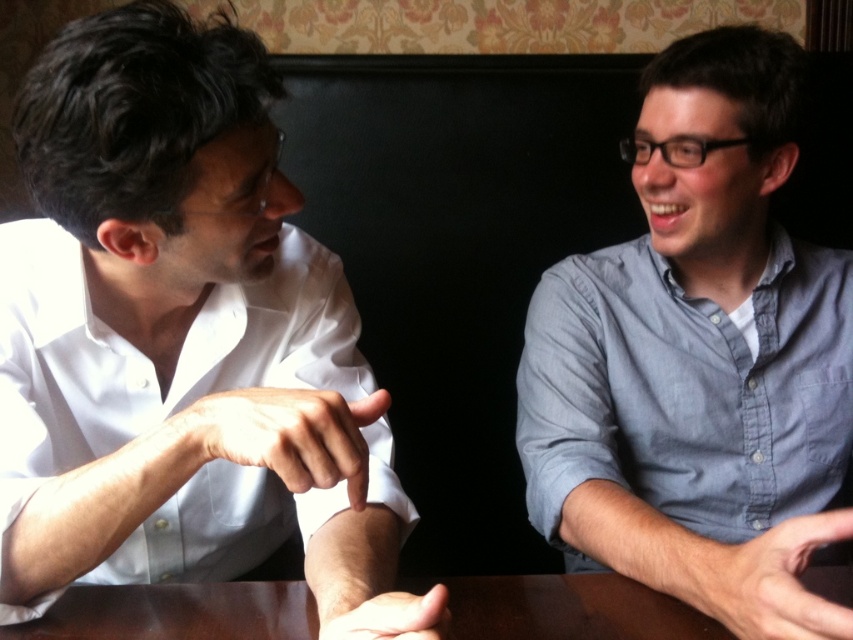
Question: Is blue denim shirt at right wider than white matte hand at center?

Choices:
 (A) yes
 (B) no

Answer: (A)

Question: Does white glossy shirt at left lie in front of brown wooden table at center?

Choices:
 (A) no
 (B) yes

Answer: (B)

Question: Is brown wooden table at center behind smooth skin hand at lower right?

Choices:
 (A) no
 (B) yes

Answer: (B)

Question: Based on their relative distances, which object is nearer to the white glossy shirt at left?

Choices:
 (A) white matte hand at center
 (B) blue denim shirt at right
 (C) smooth skin hand at lower center

Answer: (A)

Question: Considering the real-world distances, which object is closest to the smooth skin hand at lower center?

Choices:
 (A) white glossy shirt at left
 (B) smooth skin hand at lower right
 (C) blue denim shirt at right

Answer: (A)

Question: Estimate the real-world distances between objects in this image. Which object is farther from the brown wooden table at center?

Choices:
 (A) smooth skin hand at lower center
 (B) smooth skin hand at lower right
 (C) blue denim shirt at right

Answer: (C)